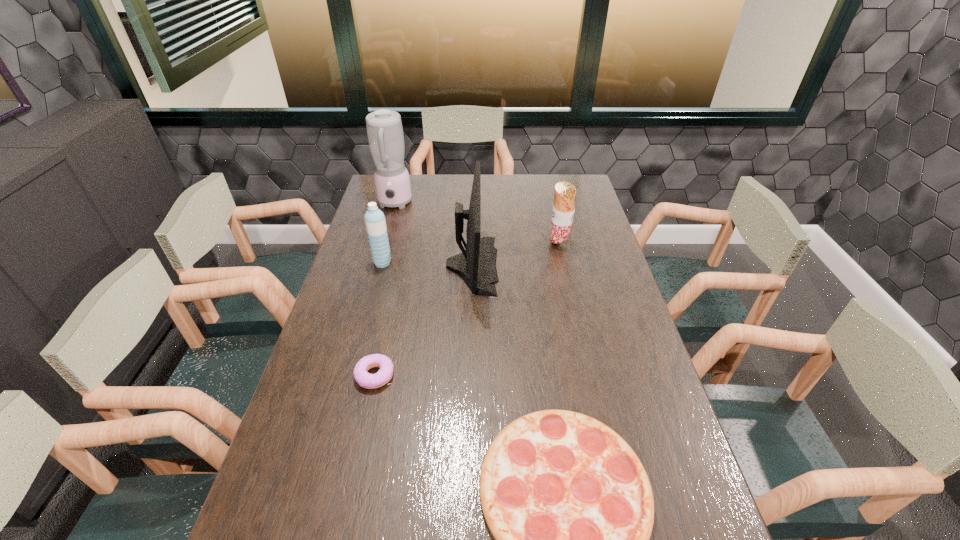
At what (x,y) coordinates should I click in order to perform the action: click on free location located on the right of the water bottle. Please return your answer as a coordinate pair (x, y). This screenshot has height=540, width=960. Looking at the image, I should click on (474, 262).

The image size is (960, 540). Identify the location of vacant space situated 0.130m on the left of the fifth farthest object. (307, 375).

Where is `object present at the far edge`? Image resolution: width=960 pixels, height=540 pixels. object present at the far edge is located at coordinates (385, 135).

The image size is (960, 540). I want to click on food processor that is at the left edge, so click(x=385, y=135).

Where is `water bottle at the left edge`? water bottle at the left edge is located at coordinates (374, 219).

Where is `doughnut that is at the left edge`? The width and height of the screenshot is (960, 540). doughnut that is at the left edge is located at coordinates (366, 380).

This screenshot has height=540, width=960. I want to click on object that is at the right edge, so click(x=563, y=210).

Locate an element on the screen. Image resolution: width=960 pixels, height=540 pixels. object located in the far left corner section of the desktop is located at coordinates (385, 135).

Image resolution: width=960 pixels, height=540 pixels. What are the coordinates of `free space at the far edge of the desktop` in the screenshot? It's located at (438, 181).

In the image, there is a desktop. Where is `free region at the left edge`? This screenshot has width=960, height=540. free region at the left edge is located at coordinates (259, 539).